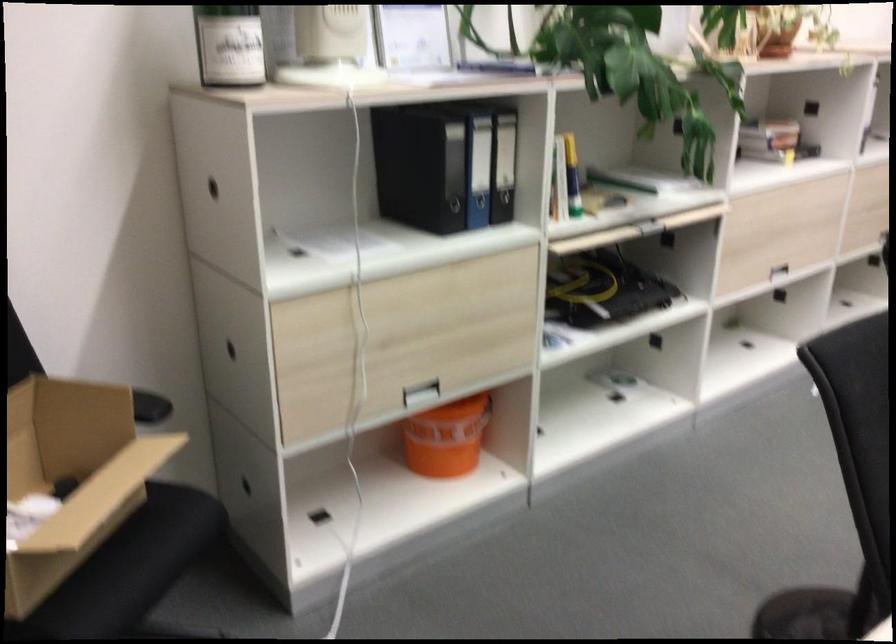
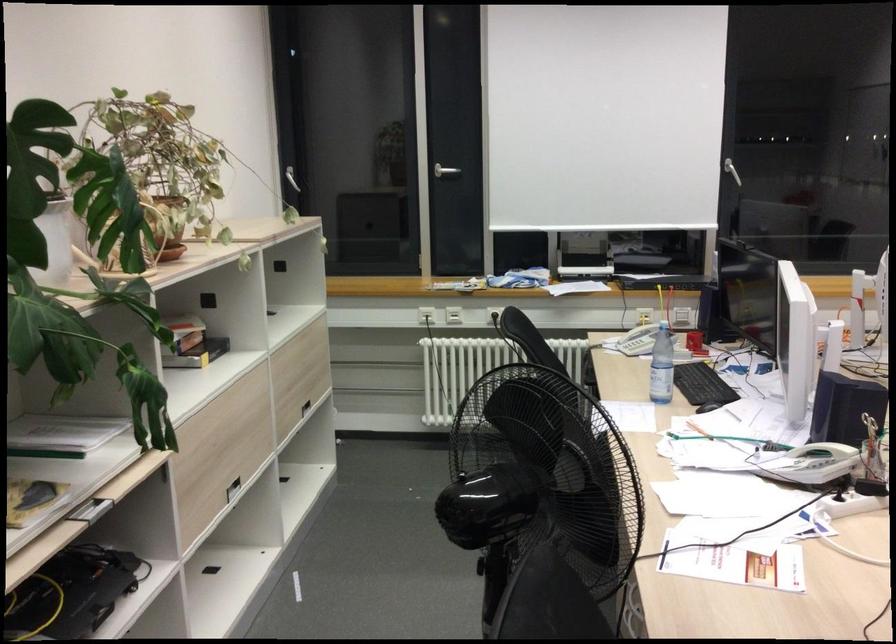
Where in the second image is the point corresponding to (x=770, y=142) from the first image?

(192, 343)